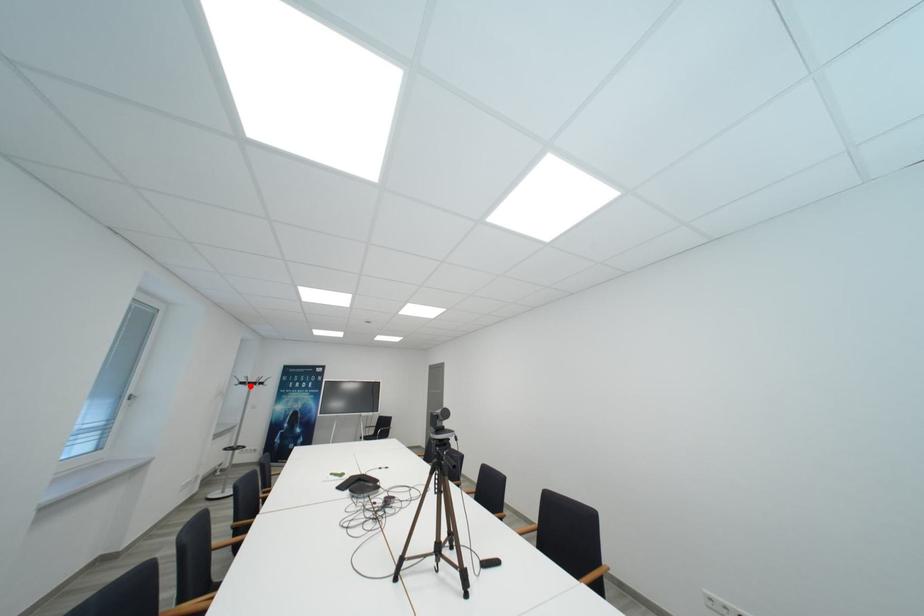
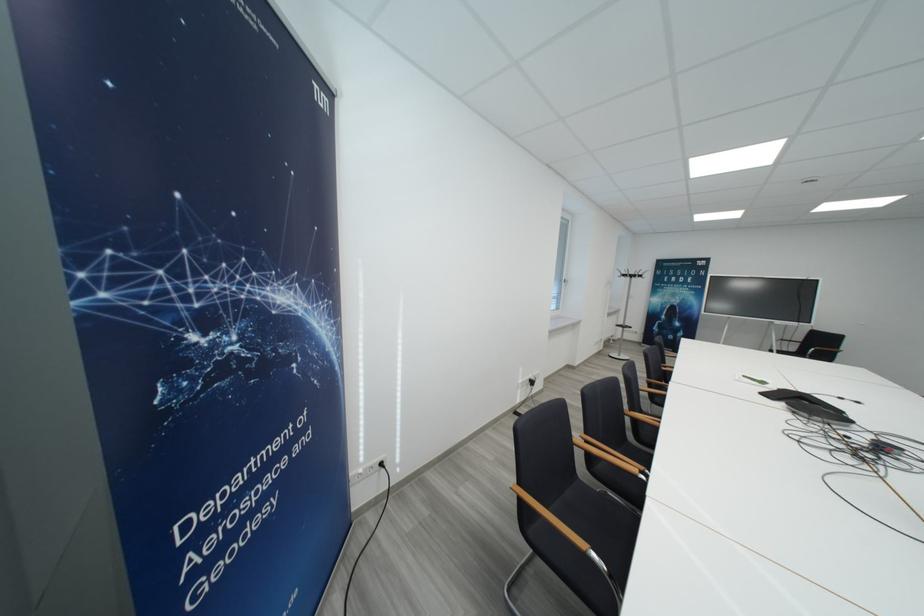
Locate, in the second image, the point that corresponds to the highlighted location in the first image.

(631, 278)